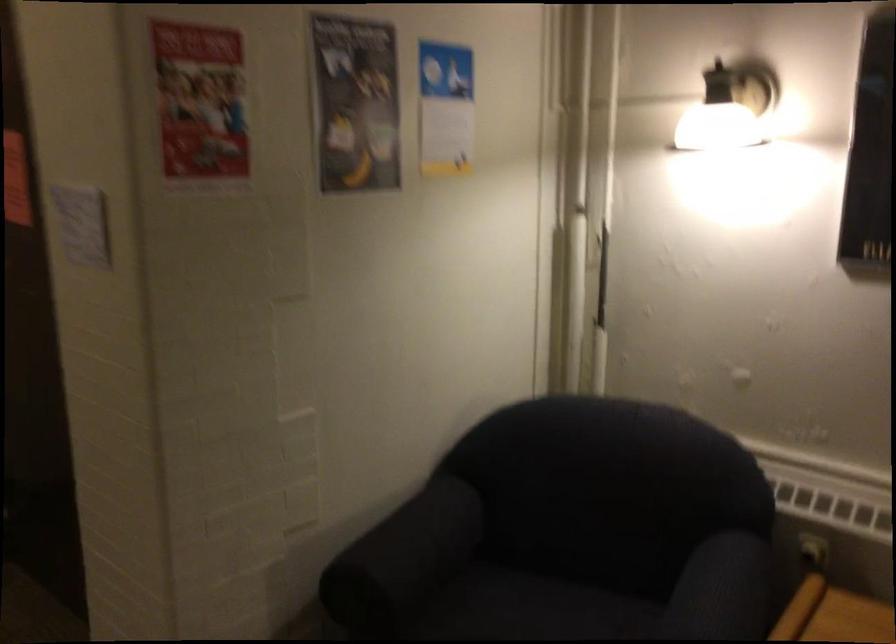
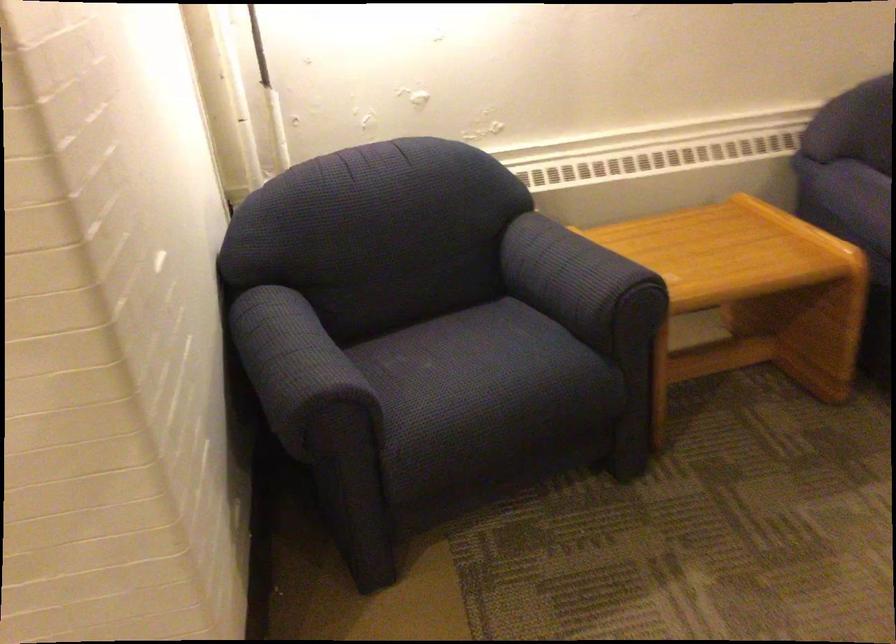
Find the pixel in the second image that matches point (375, 536) in the first image.

(294, 363)